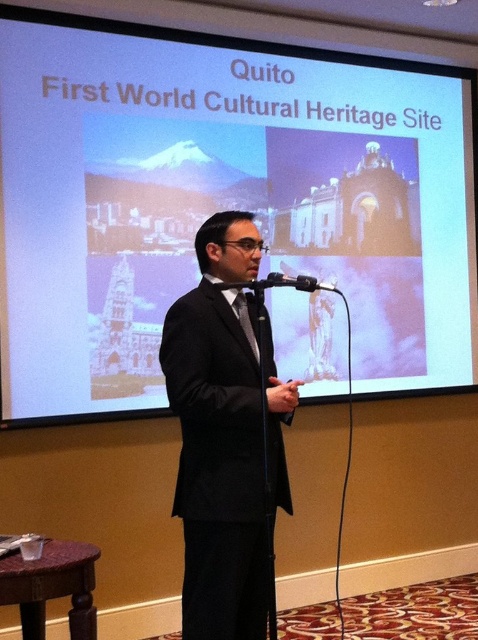
Does white matte projection screen at upper center have a lesser width compared to black suit at center?

In fact, white matte projection screen at upper center might be wider than black suit at center.

Who is higher up, white matte projection screen at upper center or black suit at center?

white matte projection screen at upper center is higher up.

Which is behind, point (19, 225) or point (254, 465)?

Point (19, 225)

Where is `white matte projection screen at upper center`? The width and height of the screenshot is (478, 640). white matte projection screen at upper center is located at coordinates (220, 202).

Is brown wood stool at lower left further to the viewer compared to black satin tie at center?

No, it is not.

Can you confirm if brown wood stool at lower left is positioned to the left of black satin tie at center?

Yes, brown wood stool at lower left is to the left of black satin tie at center.

Does point (44, 602) come behind point (249, 337)?

That is False.

Where is `brown wood stool at lower left`? brown wood stool at lower left is located at coordinates (52, 586).

Is point (280, 273) positioned behind point (253, 340)?

Yes, it is behind point (253, 340).

Does black matte microphone at center have a greater width compared to black satin tie at center?

Indeed, black matte microphone at center has a greater width compared to black satin tie at center.

Is point (278, 282) positioned before point (242, 304)?

Yes, it is.

This screenshot has width=478, height=640. Find the location of `black matte microphone at center`. black matte microphone at center is located at coordinates (296, 282).